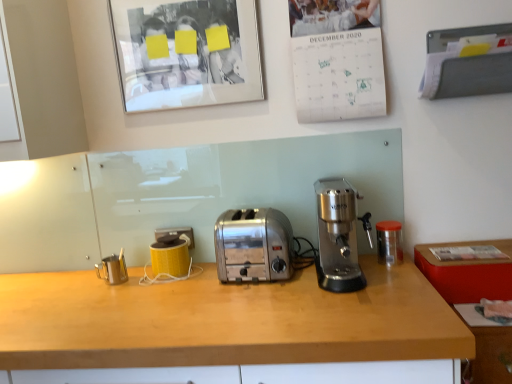
Question: Is wooden countertop at lower right facing away from brushed metal milk frother at left, the third appliance positioned from the right?

Choices:
 (A) no
 (B) yes

Answer: (A)

Question: Does wooden countertop at lower right have a greater height compared to brushed metal milk frother at left, the third appliance positioned from the right?

Choices:
 (A) yes
 (B) no

Answer: (A)

Question: From a real-world perspective, is wooden countertop at lower right positioned over brushed metal milk frother at left, the third appliance positioned from the right, based on gravity?

Choices:
 (A) no
 (B) yes

Answer: (A)

Question: Can you confirm if wooden countertop at lower right is shorter than brushed metal milk frother at left, the third appliance positioned from the right?

Choices:
 (A) yes
 (B) no

Answer: (B)

Question: From the image's perspective, does wooden countertop at lower right appear higher than brushed metal milk frother at left, the third appliance positioned from the right?

Choices:
 (A) yes
 (B) no

Answer: (B)

Question: Considering the relative sizes of wooden countertop at lower right and brushed metal milk frother at left, which appears as the first appliance when viewed from the left, in the image provided, is wooden countertop at lower right bigger than brushed metal milk frother at left, which appears as the first appliance when viewed from the left,?

Choices:
 (A) yes
 (B) no

Answer: (A)

Question: Does satin silver coffee maker at center have a smaller size compared to wooden desk at center?

Choices:
 (A) no
 (B) yes

Answer: (B)

Question: Could you tell me if satin silver coffee maker at center is turned towards wooden desk at center?

Choices:
 (A) yes
 (B) no

Answer: (B)

Question: Is wooden desk at center surrounded by satin silver coffee maker at center?

Choices:
 (A) yes
 (B) no

Answer: (B)

Question: Does satin silver coffee maker at center appear on the right side of wooden desk at center?

Choices:
 (A) no
 (B) yes

Answer: (B)

Question: From a real-world perspective, is satin silver coffee maker at center positioned under wooden desk at center based on gravity?

Choices:
 (A) yes
 (B) no

Answer: (B)

Question: Is satin silver coffee maker at center positioned beyond the bounds of wooden desk at center?

Choices:
 (A) yes
 (B) no

Answer: (A)

Question: Does transparent plastic container at right, which ranks as the 3th appliance in left-to-right order, come in front of satin chrome toaster at center?

Choices:
 (A) no
 (B) yes

Answer: (A)